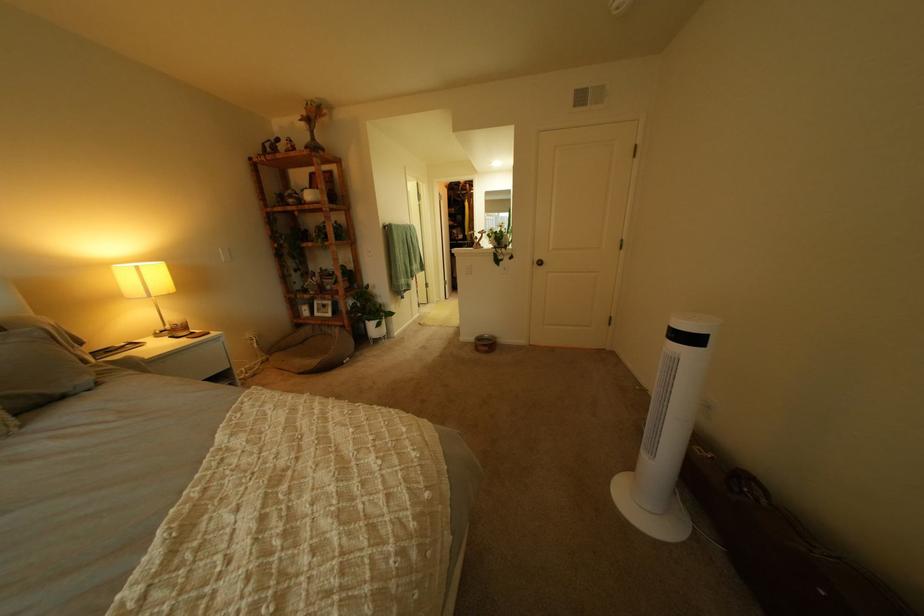
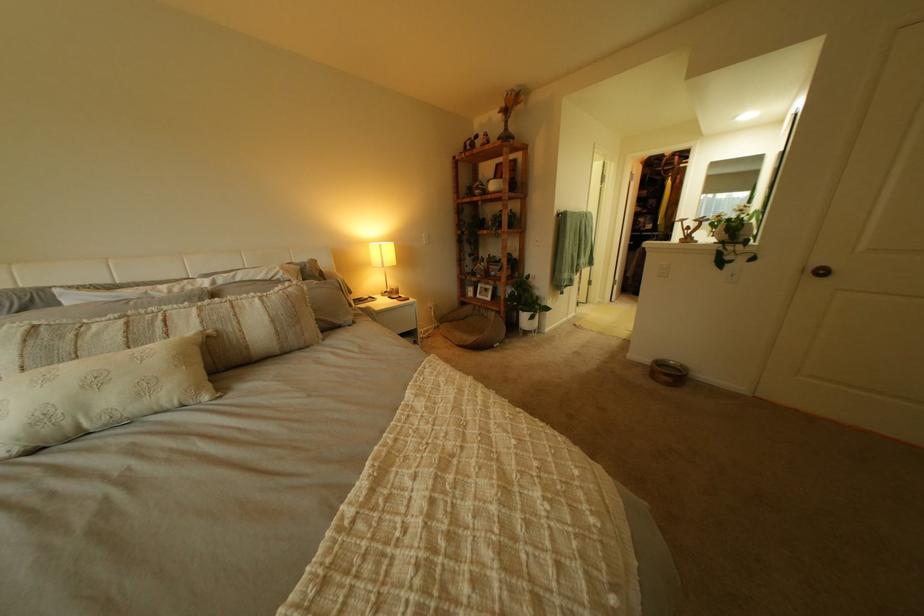
The point at (553, 265) is marked in the first image. Where is the corresponding point in the second image?

(825, 276)